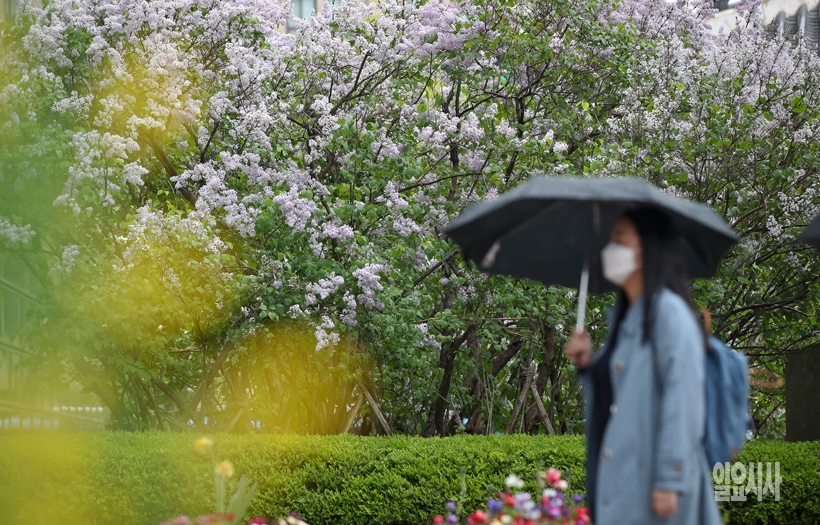
The image size is (820, 525). Identify the location of black handle. (577, 363).